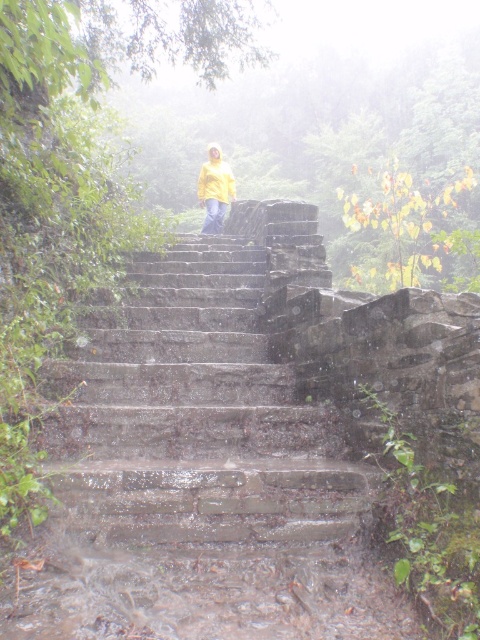
You are a hiker who has just reached the top of the wet stone stairs at center. You notice your friend wearing the yellow matte jacket at center is standing 10 meters ahead. Can you see your friend from your current position?

The wet stone stairs at center is 8.60 meters away from yellow matte jacket at center. Since your friend is only 8.60 meters away, you can see them clearly from your current position as they are within visual range.

You are a hiker who just reached the top of the wet stone stairs at center and is wearing the yellow matte jacket at center. You want to sit down to rest. Where should you place yourself to avoid sitting on the stairs?

You should sit on the yellow matte jacket at center instead of the wet stone stairs at center because the jacket is positioned above the stairs.